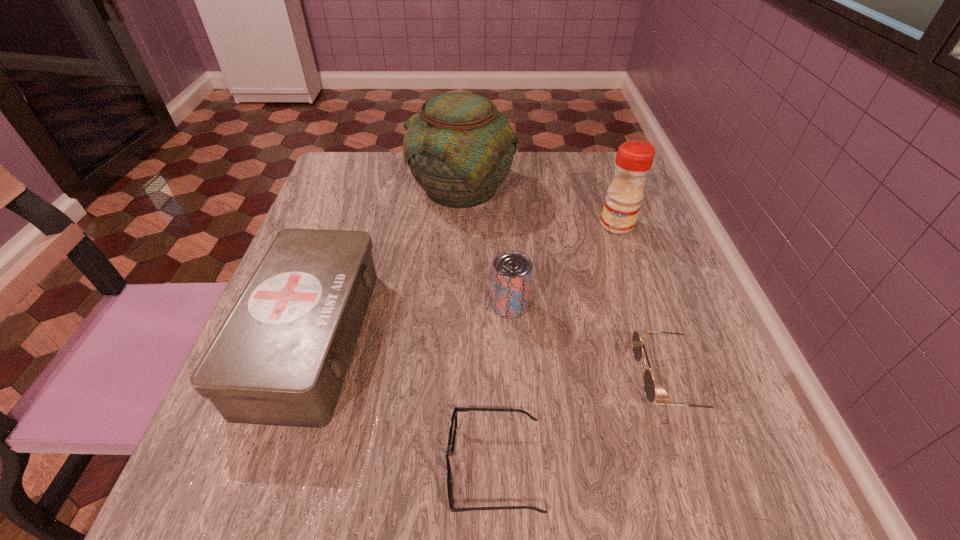
The image size is (960, 540). I want to click on sunglasses located at the right edge, so click(638, 337).

In the image, there is a desktop. Where is `free region at the far edge`? This screenshot has width=960, height=540. free region at the far edge is located at coordinates (405, 160).

The width and height of the screenshot is (960, 540). I want to click on free location at the near edge of the desktop, so click(x=556, y=489).

The height and width of the screenshot is (540, 960). In order to click on free space at the right edge of the desktop in this screenshot , I will do `click(657, 241)`.

Identify the location of vacant space at the near left corner. (256, 456).

The image size is (960, 540). I want to click on vacant space at the far right corner of the desktop, so click(595, 178).

This screenshot has height=540, width=960. In order to click on vacant point at the near right corner in this screenshot , I will do `click(671, 491)`.

You are a GUI agent. You are given a task and a screenshot of the screen. Output one action in this format:
    pyautogui.click(x=<x>, y=<y>)
    Task: Click on the free spot between the fifth tallest object and the shortest object
    The width and height of the screenshot is (960, 540).
    Given the screenshot: What is the action you would take?
    pyautogui.click(x=583, y=424)

Find the location of a particular element. This screenshot has width=960, height=540. vacant area that lies between the condiment and the sunglasses is located at coordinates (644, 302).

I want to click on empty space between the pottery and the beer can, so click(x=486, y=246).